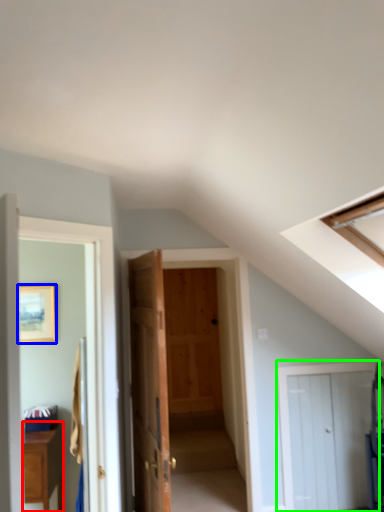
Question: Estimate the real-world distances between objects in this image. Which object is closer to cabinetry (highlighted by a red box), picture frame (highlighted by a blue box) or door (highlighted by a green box)?

Choices:
 (A) picture frame
 (B) door

Answer: (A)